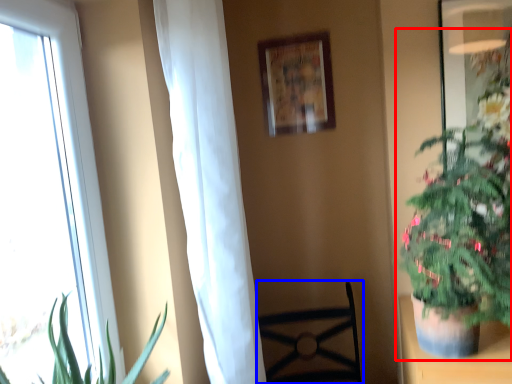
Question: Which point is closer to the camera, houseplant (highlighted by a red box) or furniture (highlighted by a blue box)?

Choices:
 (A) houseplant
 (B) furniture

Answer: (A)